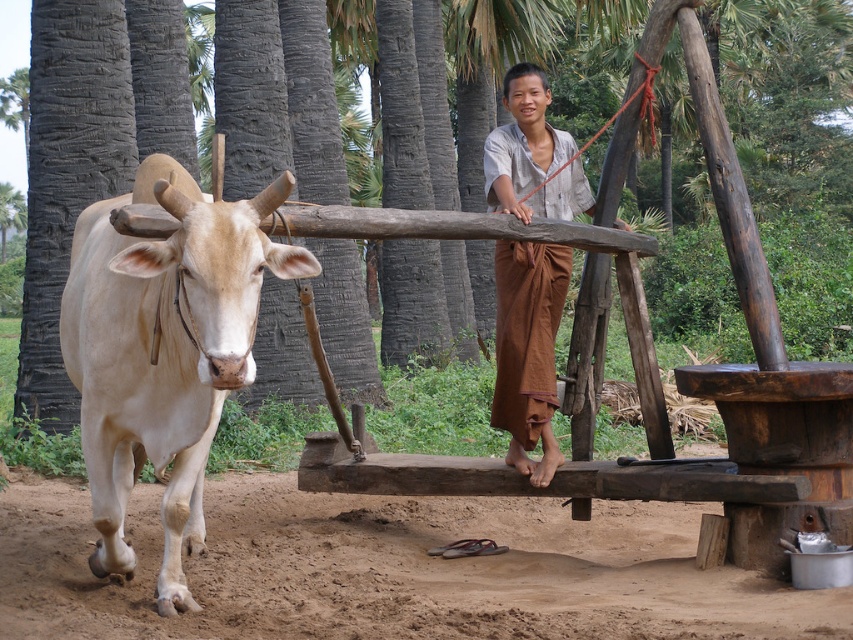
Which of these two, brown dirt field at lower center or light beige horned bull at left, stands shorter?

brown dirt field at lower center is shorter.

This screenshot has height=640, width=853. Find the location of `brown dirt field at lower center`. brown dirt field at lower center is located at coordinates (389, 570).

What are the coordinates of `brown dirt field at lower center` in the screenshot? It's located at (389, 570).

Who is shorter, brown dirt field at lower center or brown cotton skirt at center?

brown dirt field at lower center is shorter.

Which is below, brown dirt field at lower center or brown cotton skirt at center?

brown dirt field at lower center is below.

I want to click on brown dirt field at lower center, so click(389, 570).

Can you confirm if light beige horned bull at left is positioned to the right of brown cotton skirt at center?

No, light beige horned bull at left is not to the right of brown cotton skirt at center.

Can you confirm if light beige horned bull at left is positioned above brown cotton skirt at center?

Actually, light beige horned bull at left is below brown cotton skirt at center.

Describe the element at coordinates (164, 348) in the screenshot. I see `light beige horned bull at left` at that location.

Locate an element on the screen. light beige horned bull at left is located at coordinates (164, 348).